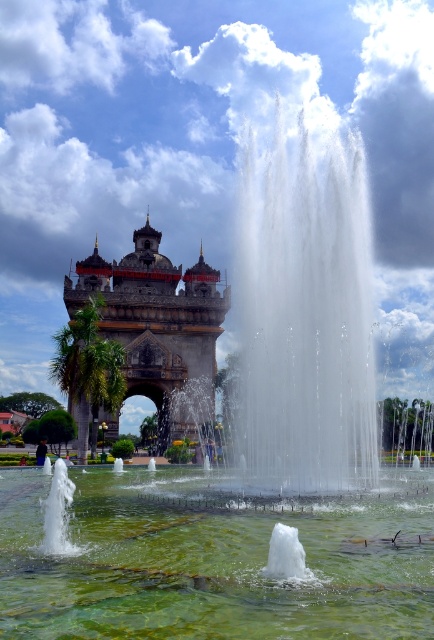
You are standing in the outdoor area and want to take a photo of the polished stone arch at center without the green translucent water at center appearing in the foreground. Is this possible given their positions?

The green translucent water at center is closer to the viewer than the polished stone arch at center, so it will appear in the foreground. To avoid it, you need to adjust your position or angle so the water is not between you and the arch.

You are an architect designing a new plaza and want to ensure the fountain can accommodate a large crowd around it. Based on the scene, which object takes up more space, the green translucent water at center or the polished stone arch at center?

The polished stone arch at center occupies more space than the green translucent water at center according to the description.